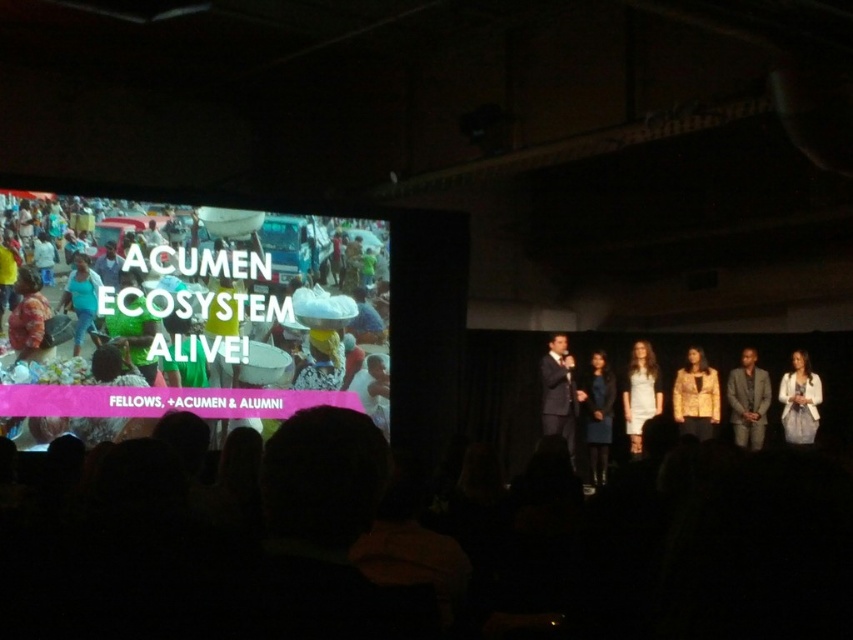
Which of these two, gold textured blazer at center or dark blue fabric dress at center, stands taller?

Standing taller between the two is gold textured blazer at center.

Between gold textured blazer at center and dark blue fabric dress at center, which one is positioned higher?

gold textured blazer at center is above.

Which is behind, point (688, 358) or point (589, 435)?

Positioned behind is point (688, 358).

The width and height of the screenshot is (853, 640). I want to click on gold textured blazer at center, so click(695, 396).

Between gold textured blazer at center and gray textured suit at center, which one has less height?

gold textured blazer at center

Which of these two, gold textured blazer at center or gray textured suit at center, stands taller?

Standing taller between the two is gray textured suit at center.

I want to click on gold textured blazer at center, so click(695, 396).

What do you see at coordinates (799, 401) in the screenshot?
I see `white textured jacket at right` at bounding box center [799, 401].

Between white textured jacket at right and matte blue shirt at center, which one appears on the left side from the viewer's perspective?

A: matte blue shirt at center

Identify the location of white textured jacket at right. The height and width of the screenshot is (640, 853). (799, 401).

The image size is (853, 640). I want to click on white textured jacket at right, so [x=799, y=401].